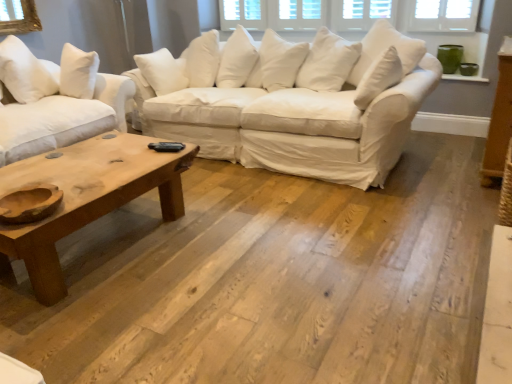
Question: In terms of width, does natural wood studio couch at left, positioned as the second studio couch in right-to-left order, look wider or thinner when compared to white cotton couch at center, acting as the 1th studio couch starting from the right?

Choices:
 (A) thin
 (B) wide

Answer: (B)

Question: From their relative heights in the image, would you say natural wood studio couch at left, positioned as the second studio couch in right-to-left order, is taller or shorter than white cotton couch at center, acting as the 1th studio couch starting from the right?

Choices:
 (A) short
 (B) tall

Answer: (B)

Question: Which object is positioned farthest from the white cotton pillow at upper left?

Choices:
 (A) white cotton couch at center, which is counted as the 2th studio couch, starting from the left
 (B) natural wood coffee table at lower left
 (C) natural wood studio couch at left, positioned as the second studio couch in right-to-left order

Answer: (A)

Question: Estimate the real-world distances between objects in this image. Which object is farther from the natural wood coffee table at lower left?

Choices:
 (A) white cotton couch at center, which is counted as the 2th studio couch, starting from the left
 (B) white cotton pillow at upper left
 (C) natural wood studio couch at left, positioned as the second studio couch in right-to-left order

Answer: (B)